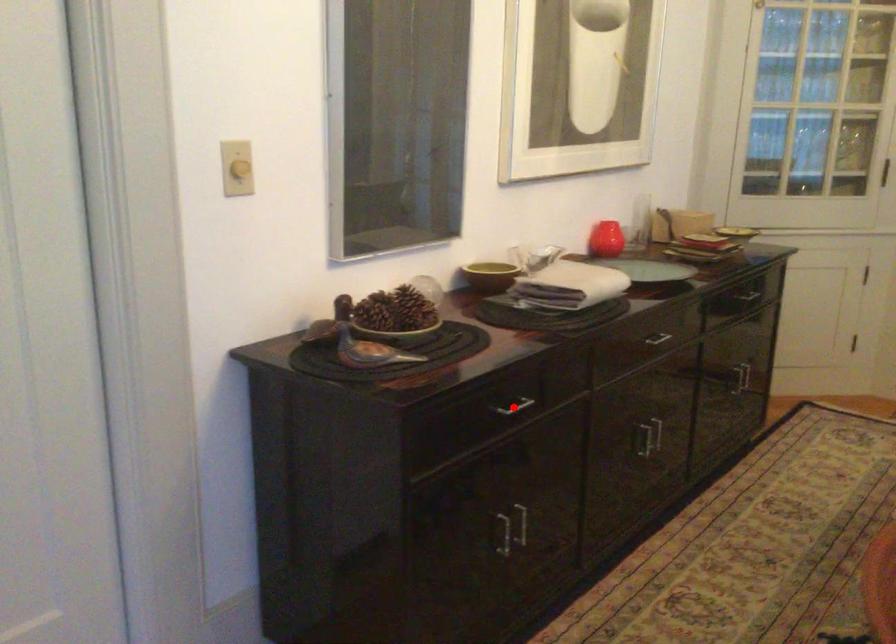
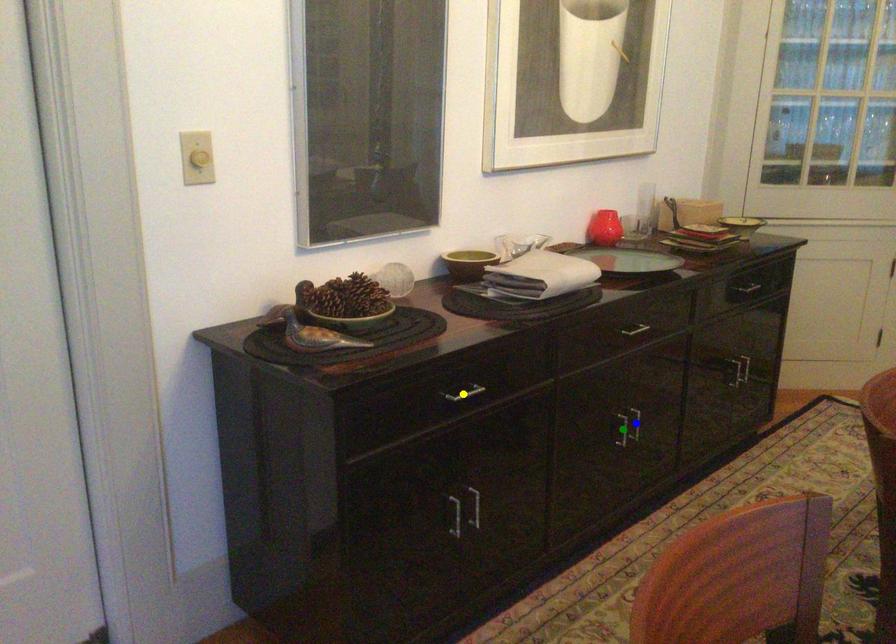
Question: I am providing you with two images of the same scene from different viewpoints. A red point is marked on the first image. You are given multiple points on the second image. Which mark in image 2 goes with the point in image 1?

Choices:
 (A) yellow point
 (B) green point
 (C) blue point

Answer: (A)